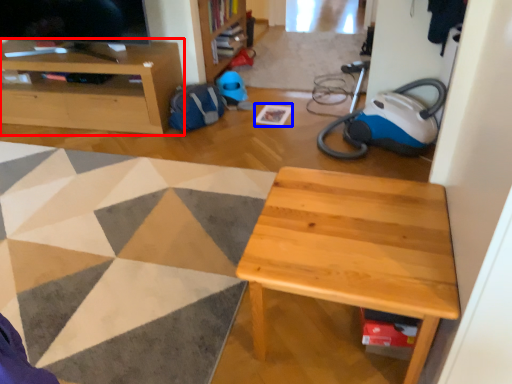
Question: Which of the following is the closest to the observer, cabinetry (highlighted by a red box) or square (highlighted by a blue box)?

Choices:
 (A) cabinetry
 (B) square

Answer: (A)